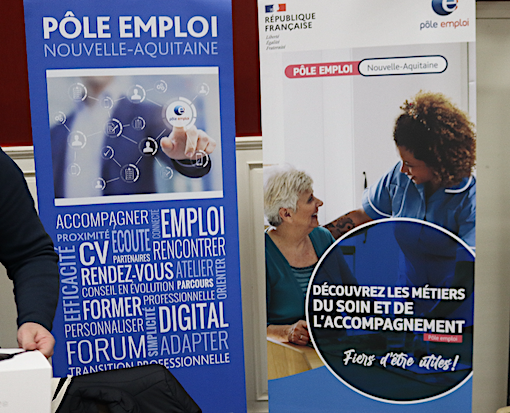
I want to click on red wall, so click(x=248, y=40), click(x=15, y=95).